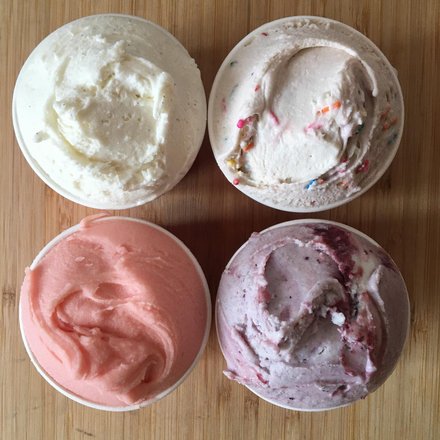
I want to click on clear table space to the left of ice cream, so click(31, 219).